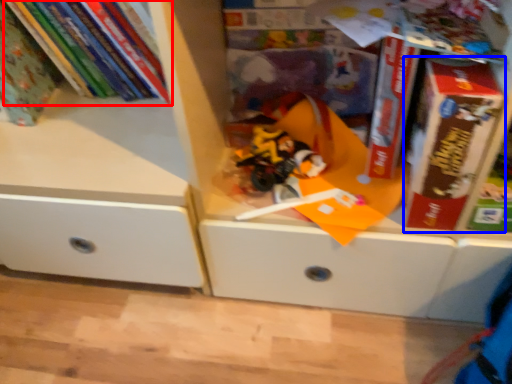
Question: Which point is further to the camera, book (highlighted by a red box) or paperback book (highlighted by a blue box)?

Choices:
 (A) book
 (B) paperback book

Answer: (A)